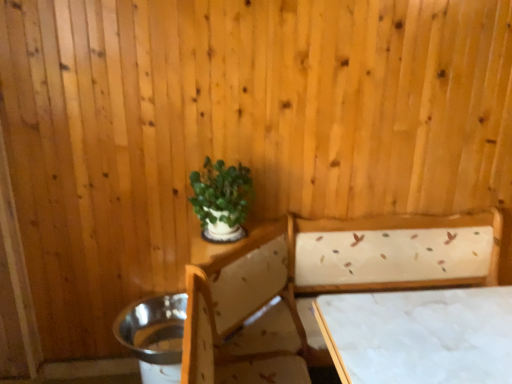
Question: Is white fabric-covered table at lower right at the left side of green matte plant at upper center?

Choices:
 (A) yes
 (B) no

Answer: (B)

Question: Considering the relative sizes of white fabric-covered table at lower right and green matte plant at upper center in the image provided, is white fabric-covered table at lower right smaller than green matte plant at upper center?

Choices:
 (A) yes
 (B) no

Answer: (B)

Question: From the image's perspective, would you say white fabric-covered table at lower right is shown under green matte plant at upper center?

Choices:
 (A) yes
 (B) no

Answer: (A)

Question: From a real-world perspective, is white fabric-covered table at lower right over green matte plant at upper center?

Choices:
 (A) yes
 (B) no

Answer: (B)

Question: Is white fabric-covered table at lower right at the right side of green matte plant at upper center?

Choices:
 (A) no
 (B) yes

Answer: (B)

Question: Based on their positions, is green matte plant at upper center located to the left or right of white fabric-covered table at lower right?

Choices:
 (A) right
 (B) left

Answer: (B)

Question: From the image's perspective, is green matte plant at upper center positioned above or below white fabric-covered table at lower right?

Choices:
 (A) above
 (B) below

Answer: (A)

Question: Based on their sizes in the image, would you say green matte plant at upper center is bigger or smaller than white fabric-covered table at lower right?

Choices:
 (A) big
 (B) small

Answer: (B)

Question: In the image, is green matte plant at upper center positioned in front of or behind white fabric-covered table at lower right?

Choices:
 (A) front
 (B) behind

Answer: (B)

Question: Is white fabric bed at center situated inside green matte plant at upper center or outside?

Choices:
 (A) inside
 (B) outside

Answer: (B)

Question: Is point (311, 291) closer or farther from the camera than point (207, 193)?

Choices:
 (A) closer
 (B) farther

Answer: (B)

Question: Is white fabric bed at center bigger or smaller than green matte plant at upper center?

Choices:
 (A) big
 (B) small

Answer: (A)

Question: From a real-world perspective, is white fabric bed at center physically located above or below green matte plant at upper center?

Choices:
 (A) below
 (B) above

Answer: (A)

Question: From a real-world perspective, is white fabric bed at center physically located above or below white fabric-covered table at lower right?

Choices:
 (A) above
 (B) below

Answer: (B)

Question: In the image, is white fabric bed at center positioned in front of or behind white fabric-covered table at lower right?

Choices:
 (A) front
 (B) behind

Answer: (A)